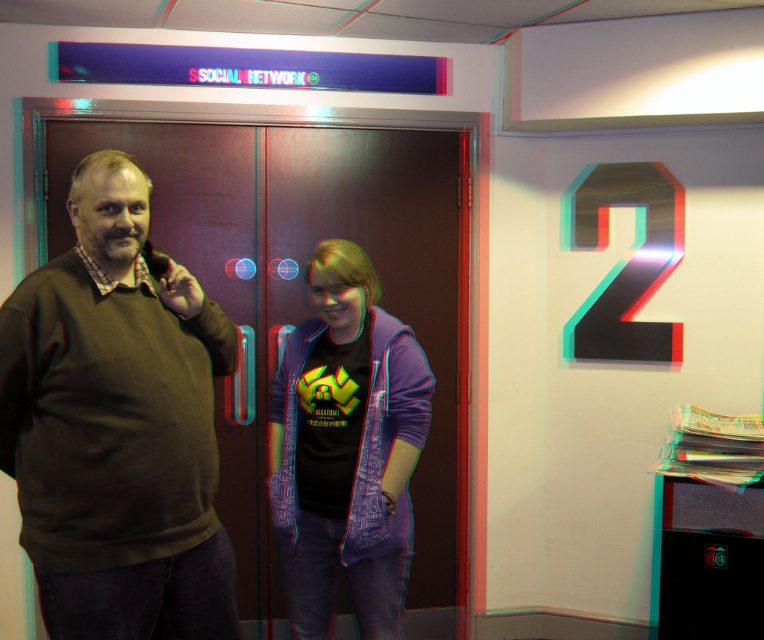
Question: Which point is farther to the camera?

Choices:
 (A) brown matte sweater at left
 (B) matte purple jacket at center

Answer: (B)

Question: Can you confirm if brown matte sweater at left is positioned below matte purple jacket at center?

Choices:
 (A) yes
 (B) no

Answer: (B)

Question: Which object appears closest to the camera in this image?

Choices:
 (A) matte purple jacket at center
 (B) brown matte sweater at left

Answer: (B)

Question: Can you confirm if brown matte sweater at left is smaller than matte purple jacket at center?

Choices:
 (A) no
 (B) yes

Answer: (A)

Question: Does brown matte sweater at left appear under matte purple jacket at center?

Choices:
 (A) yes
 (B) no

Answer: (B)

Question: Which of the following is the farthest from the observer?

Choices:
 (A) (105, 618)
 (B) (311, 371)

Answer: (B)